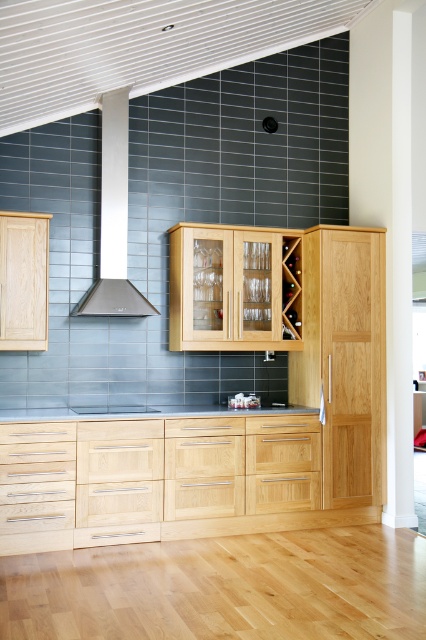
You are a kitchen designer planning to install a new microwave oven that requires a minimum of 30 cm of vertical space. You see the white glossy exhaust hood at upper center and the black laminate countertop at center. Which object provides sufficient vertical space for the microwave?

The white glossy exhaust hood at upper center is much taller than the black laminate countertop at center, so it can provide the required vertical space for the microwave oven.

You are a delivery person holding a large package that is 15 feet long. You need to place it in the kitchen shown in the image. Can you fit the package in front of the light wood cabinet at center without moving any other furniture?

The light wood cabinet at center is 14.78 feet away from the camera, which is shorter than the 15 feet long package. Therefore, the package cannot fit in front of the light wood cabinet at center without moving other furniture.